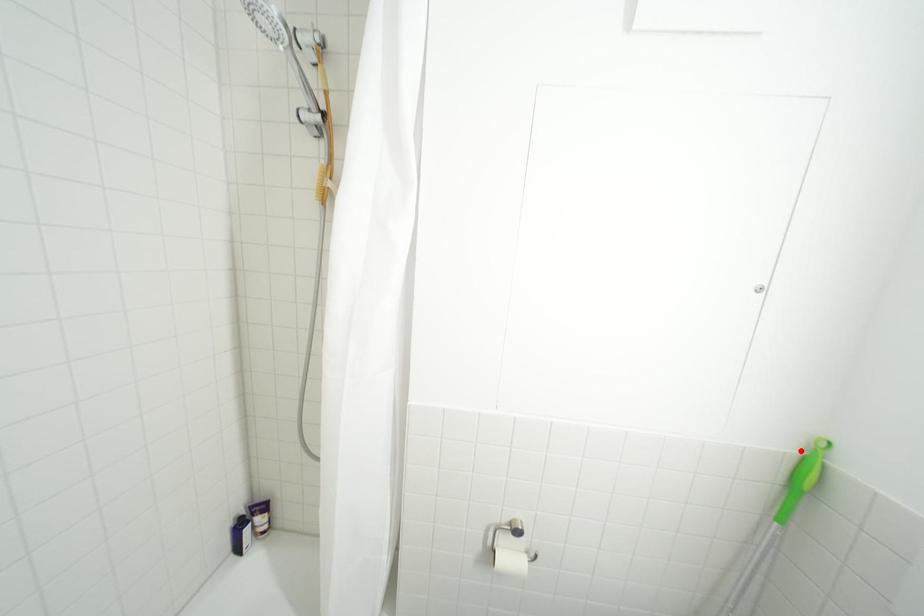
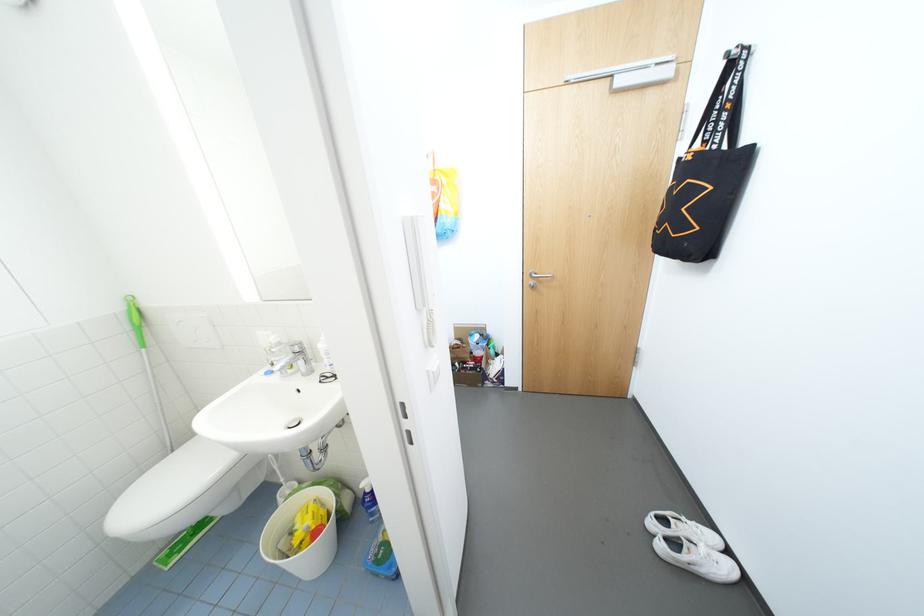
Where in the second image is the point corresponding to the highlighted location from the first image?

(126, 310)